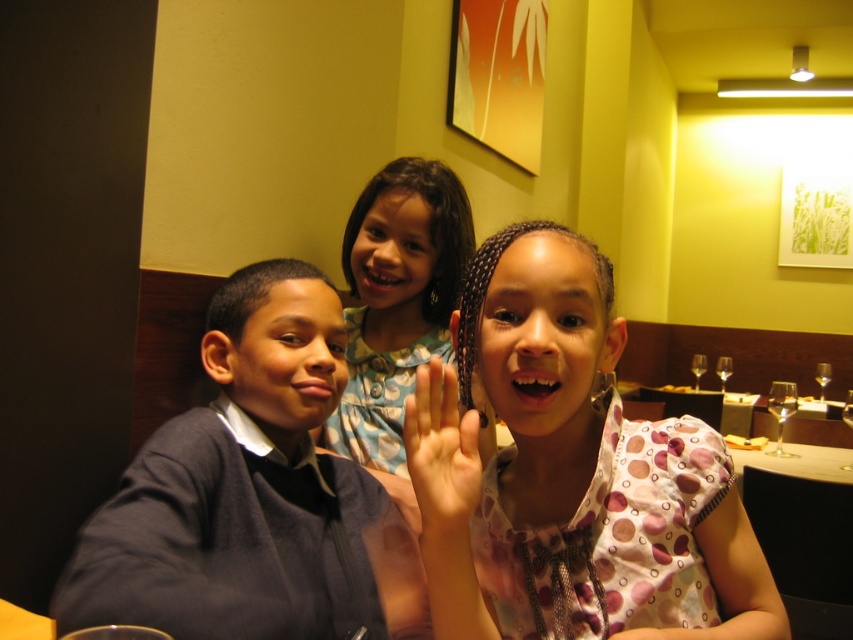
Question: Which is nearer to the light skin tone palm at center?

Choices:
 (A) dark blue sweater at left
 (B) pink dotted dress at center

Answer: (B)

Question: Which point is closer to the camera taking this photo?

Choices:
 (A) (465, 456)
 (B) (383, 230)
 (C) (489, 326)
 (D) (376, 493)

Answer: (A)

Question: Which point is farther to the camera?

Choices:
 (A) (264, 460)
 (B) (450, 579)
 (C) (473, 458)

Answer: (A)

Question: Can you confirm if dark blue sweater at left is positioned above blue dotted dress at center?

Choices:
 (A) yes
 (B) no

Answer: (B)

Question: Can you confirm if pink dotted dress at center is smaller than light skin tone palm at center?

Choices:
 (A) yes
 (B) no

Answer: (B)

Question: Does dark blue sweater at left have a smaller size compared to light skin tone palm at center?

Choices:
 (A) yes
 (B) no

Answer: (B)